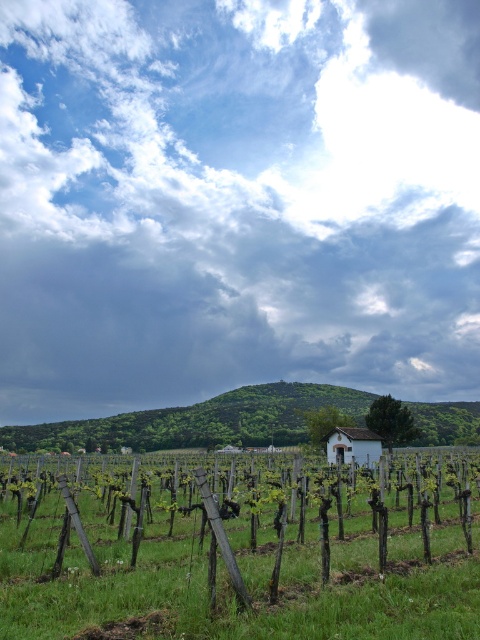
Question: Does cloudy sky at upper center appear on the left side of green leafy hillside at center?

Choices:
 (A) yes
 (B) no

Answer: (A)

Question: Which of the following is the closest to the observer?

Choices:
 (A) green leafy hillside at center
 (B) cloudy sky at upper center
 (C) green grassy field at center

Answer: (C)

Question: Which object is farther from the camera taking this photo?

Choices:
 (A) green grassy field at center
 (B) green leafy hillside at center
 (C) cloudy sky at upper center

Answer: (C)

Question: Does cloudy sky at upper center appear on the left side of green grassy field at center?

Choices:
 (A) yes
 (B) no

Answer: (A)

Question: Considering the real-world distances, which object is closest to the cloudy sky at upper center?

Choices:
 (A) green leafy hillside at center
 (B) green grassy field at center

Answer: (A)

Question: Is cloudy sky at upper center above green leafy hillside at center?

Choices:
 (A) no
 (B) yes

Answer: (B)